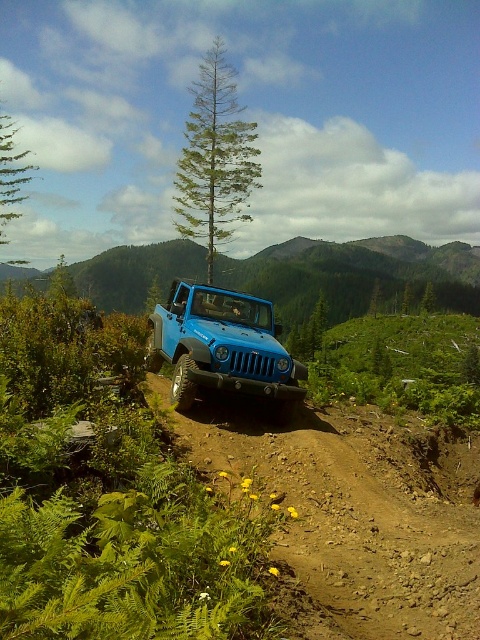
You are a hiker planning to walk from the green leafy shrubs at center to the matte blue jeep at center. Which direction should you move to reach the jeep?

The green leafy shrubs at center are to the right of the matte blue jeep at center, so you should move to the left to reach the matte blue jeep at center.